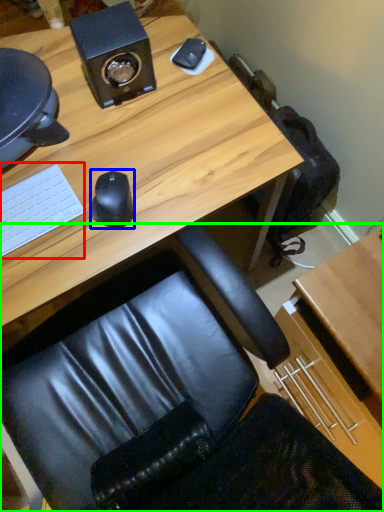
Question: Considering the real-world distances, which object is farthest from laptop keyboard (highlighted by a red box)? mouse (highlighted by a blue box) or chair (highlighted by a green box)?

Choices:
 (A) mouse
 (B) chair

Answer: (B)